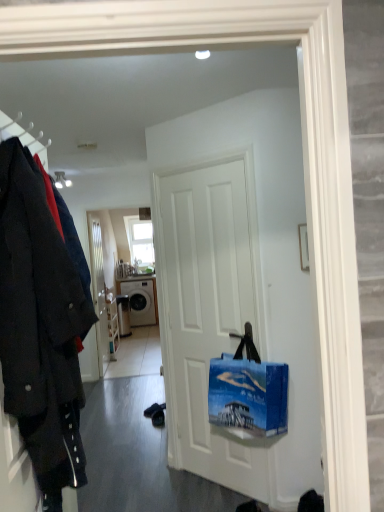
Question: Considering the positions of point (3, 269) and point (228, 445), is point (3, 269) closer or farther from the camera than point (228, 445)?

Choices:
 (A) closer
 (B) farther

Answer: (A)

Question: Considering the positions of dark wool coat at left and white matte door at center, placed as the second door when sorted from back to front, in the image, is dark wool coat at left taller or shorter than white matte door at center, placed as the second door when sorted from back to front,?

Choices:
 (A) tall
 (B) short

Answer: (B)

Question: Which object is the farthest from the clear glass window at upper center?

Choices:
 (A) blue canvas bag at center
 (B) white glossy door at center, which is the 2th door from front to back
 (C) matte white ceiling light at upper center
 (D) dark wool coat at left
 (E) white glossy washing machine at center

Answer: (D)

Question: Estimate the real-world distances between objects in this image. Which object is closer to the clear glass window at upper center?

Choices:
 (A) white glossy door at center, the first door from the left
 (B) white matte door at center, the second door when ordered from left to right
 (C) white glossy washing machine at center
 (D) matte white ceiling light at upper center
 (E) dark wool coat at left

Answer: (C)